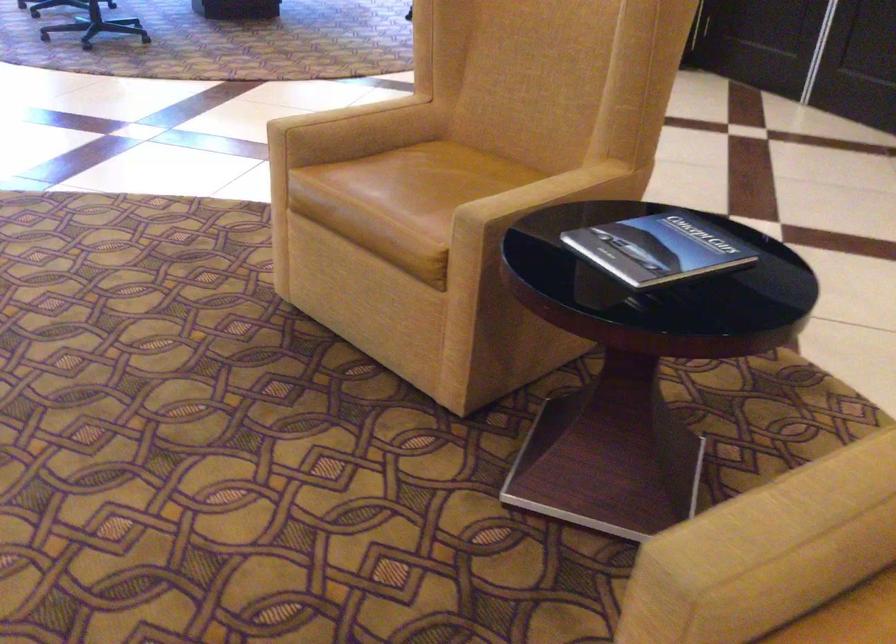
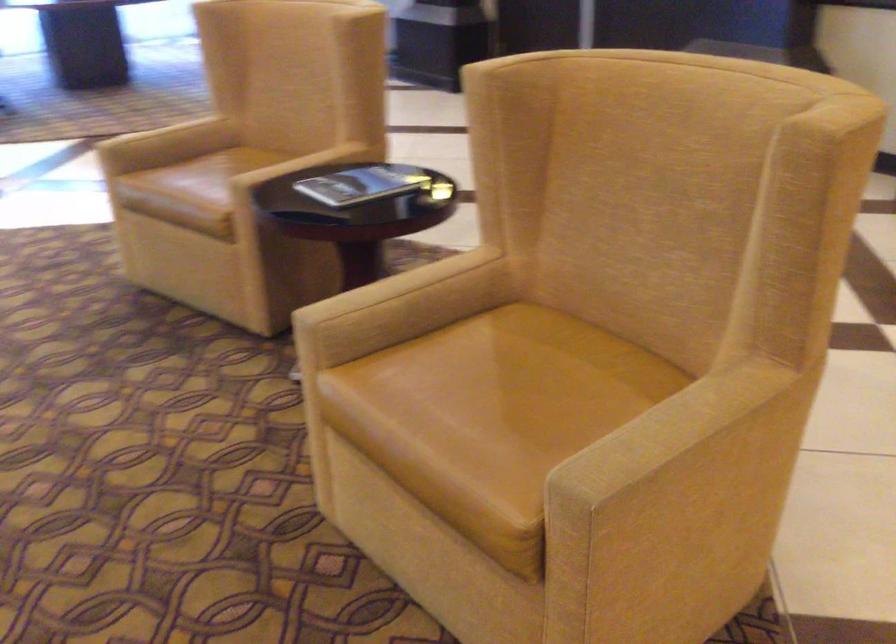
Where in the second image is the point corresponding to the point at 394,185 from the first image?

(199, 176)